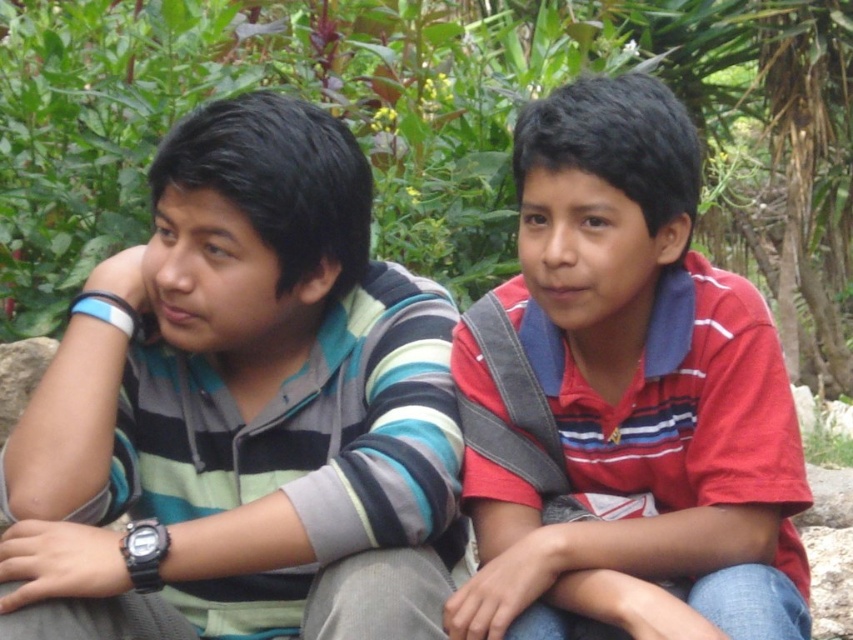
You are a photographer trying to capture both the striped cotton shirt at left and the red striped shirt at center in a single shot. Based on their positions, which shirt should you focus on first to ensure both are in frame?

The striped cotton shirt at left is located above the red striped shirt at center, so you should focus on the red striped shirt at center first to ensure both are in frame.

You are a hiker who needs to choose a stone to place in your backpack. You have two options in the image, the gray stone at lower right and the gray stone at lower center. Which stone is smaller and better suited for your backpack?

The gray stone at lower right is smaller than the gray stone at lower center, making it better suited for your backpack.